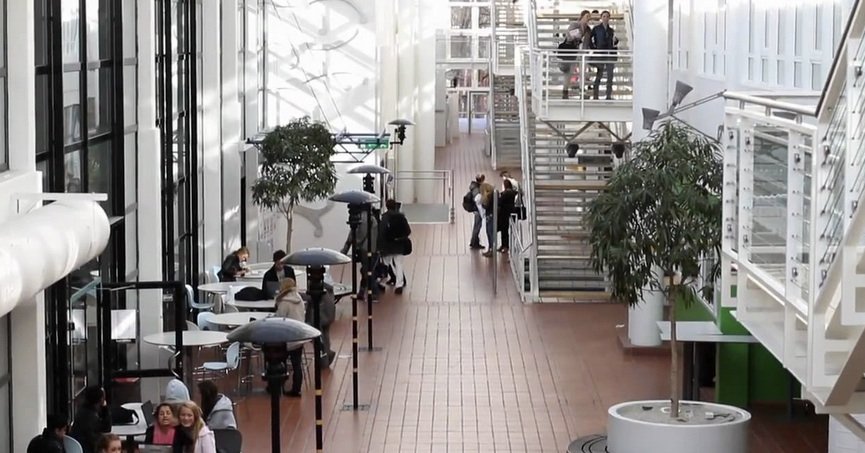
Identify the location of door. (476, 113), (465, 115).